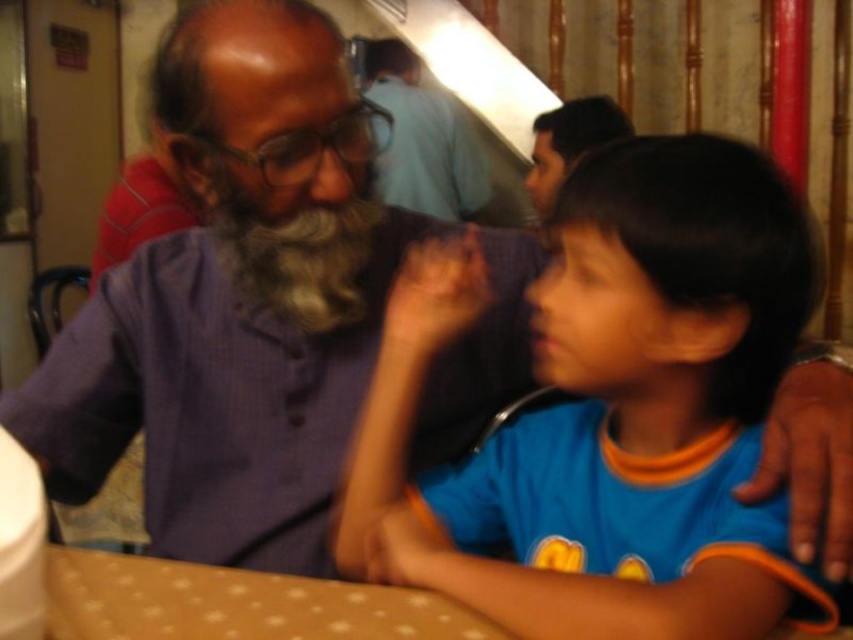
Question: Does blue cotton shirt at center appear over brown fabric table at lower center?

Choices:
 (A) yes
 (B) no

Answer: (A)

Question: Which point is farther to the camera?

Choices:
 (A) (178, 573)
 (B) (322, 296)
 (C) (680, 294)

Answer: (B)

Question: Based on their relative distances, which object is farther from the graywoollybeard at center?

Choices:
 (A) matte purple shirt at center
 (B) brown fabric table at lower center

Answer: (A)

Question: Which of the following is the closest to the observer?

Choices:
 (A) (570, 624)
 (B) (422, 93)
 (C) (364, 637)
 (D) (363, 220)

Answer: (A)

Question: Is blue cotton shirt at center behind brown fabric table at lower center?

Choices:
 (A) yes
 (B) no

Answer: (B)

Question: Observing the image, what is the correct spatial positioning of brown fabric table at lower center in reference to graywoollybeard at center?

Choices:
 (A) right
 (B) left

Answer: (A)